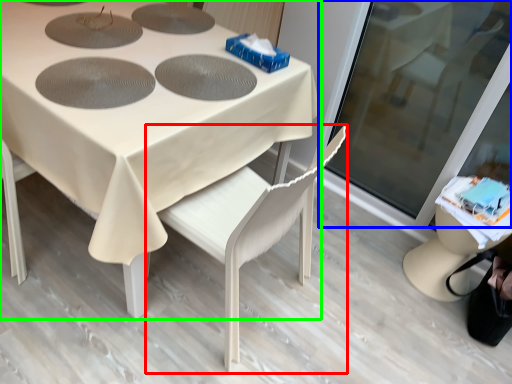
Question: Which is nearer to the chair (highlighted by a red box)? screen door (highlighted by a blue box) or table (highlighted by a green box).

Choices:
 (A) screen door
 (B) table

Answer: (B)